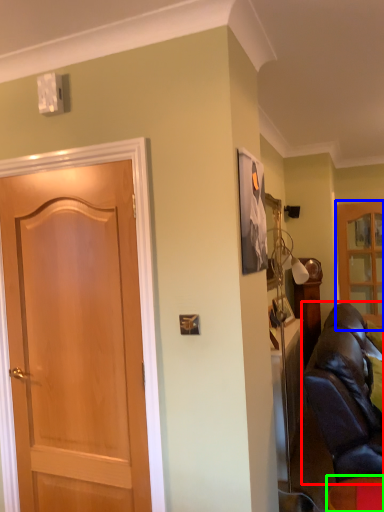
Question: Estimate the real-world distances between objects in this image. Which object is closer to studio couch (highlighted by a red box), cabinetry (highlighted by a blue box) or furniture (highlighted by a green box)?

Choices:
 (A) cabinetry
 (B) furniture

Answer: (B)